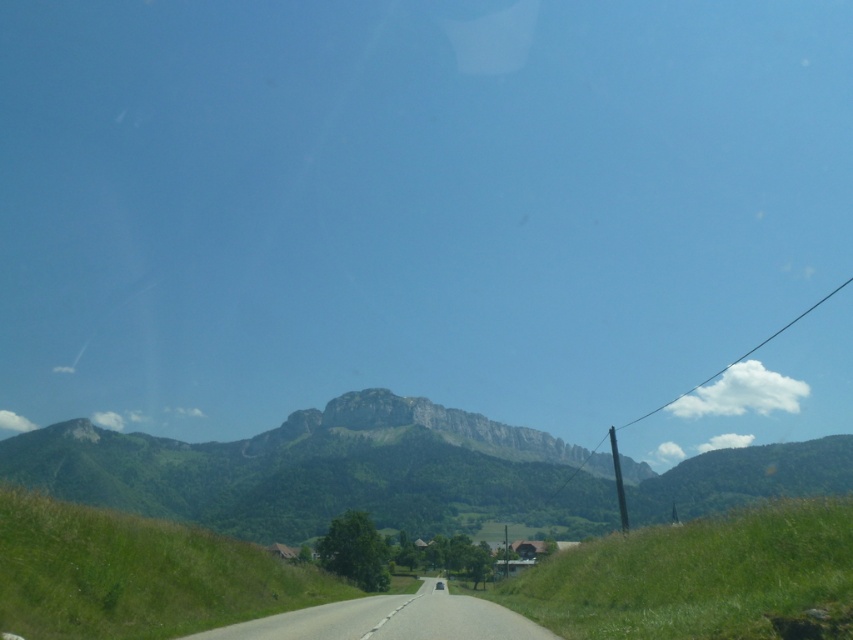
Question: Does gray asphalt road at center have a larger size compared to transparent glass car window at center?

Choices:
 (A) yes
 (B) no

Answer: (A)

Question: Which point appears farthest from the camera in this image?

Choices:
 (A) (433, 588)
 (B) (399, 616)

Answer: (A)

Question: Is gray asphalt road at center thinner than transparent glass car window at center?

Choices:
 (A) yes
 (B) no

Answer: (B)

Question: Which point appears farthest from the camera in this image?

Choices:
 (A) (428, 582)
 (B) (439, 580)

Answer: (B)

Question: Can you confirm if gray asphalt road at center is bigger than transparent glass car window at center?

Choices:
 (A) no
 (B) yes

Answer: (B)